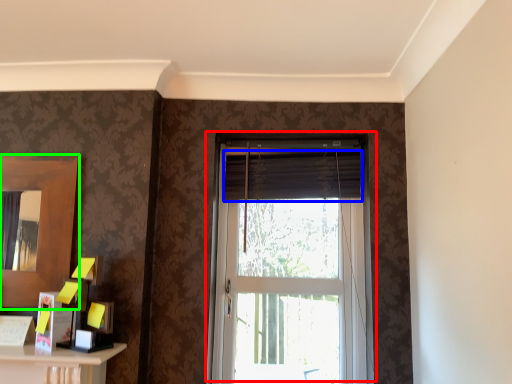
Question: Estimate the real-world distances between objects in this image. Which object is farther from window (highlighted by a red box), curtain (highlighted by a blue box) or mirror (highlighted by a green box)?

Choices:
 (A) curtain
 (B) mirror

Answer: (B)